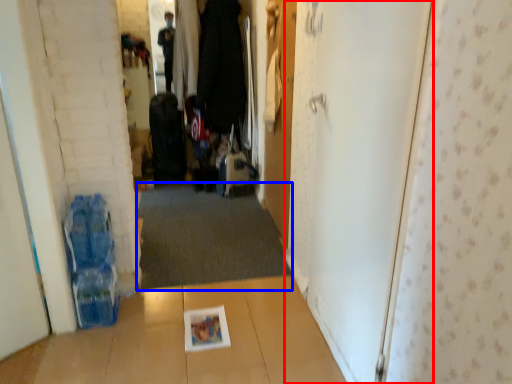
Question: Among these objects, which one is farthest to the camera, door (highlighted by a red box) or doormat (highlighted by a blue box)?

Choices:
 (A) door
 (B) doormat

Answer: (B)